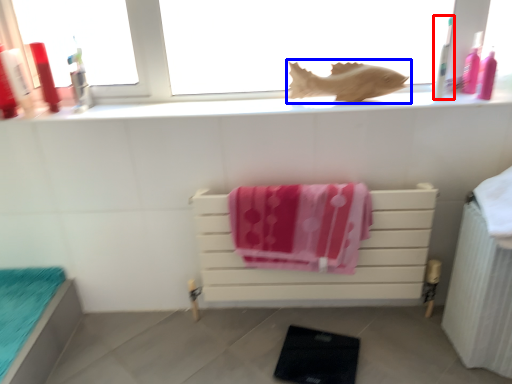
Question: Which object appears farthest to the camera in this image, toiletry (highlighted by a red box) or animal (highlighted by a blue box)?

Choices:
 (A) toiletry
 (B) animal

Answer: (B)